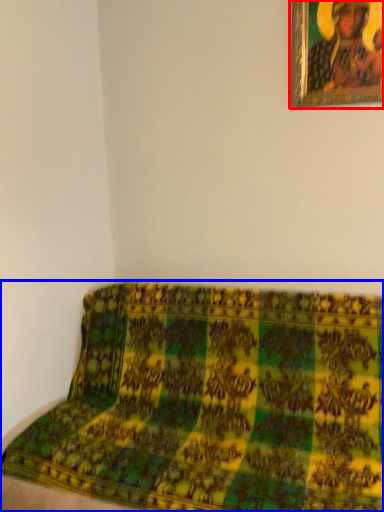
Question: Which object is closer to the camera taking this photo, picture frame (highlighted by a red box) or furniture (highlighted by a blue box)?

Choices:
 (A) picture frame
 (B) furniture

Answer: (B)